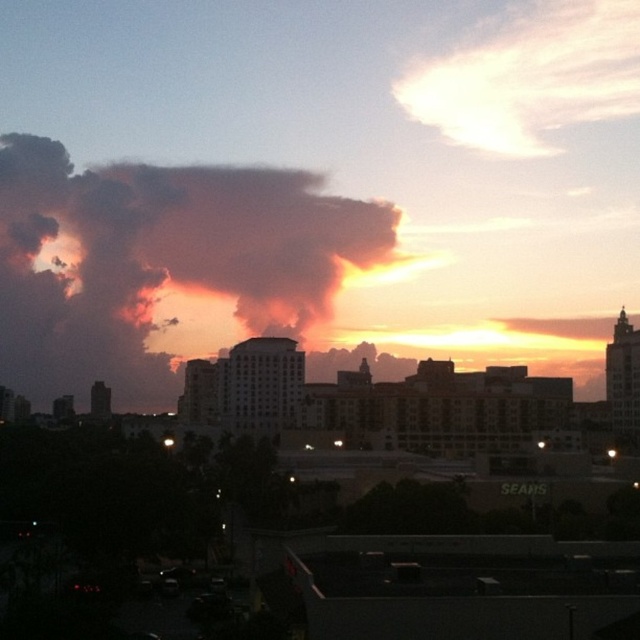
Is dark orange smoke at upper left to the right of pastel pink cotton cloud at upper right from the viewer's perspective?

No, dark orange smoke at upper left is not to the right of pastel pink cotton cloud at upper right.

Can you confirm if dark orange smoke at upper left is thinner than pastel pink cotton cloud at upper right?

Incorrect, dark orange smoke at upper left's width is not less than pastel pink cotton cloud at upper right's.

Is point (346, 198) positioned before point (612, 40)?

Yes, point (346, 198) is in front of point (612, 40).

You are a GUI agent. You are given a task and a screenshot of the screen. Output one action in this format:
    pyautogui.click(x=<x>, y=<y>)
    Task: Click on the dark orange smoke at upper left
    The image size is (640, 640).
    Given the screenshot: What is the action you would take?
    click(161, 260)